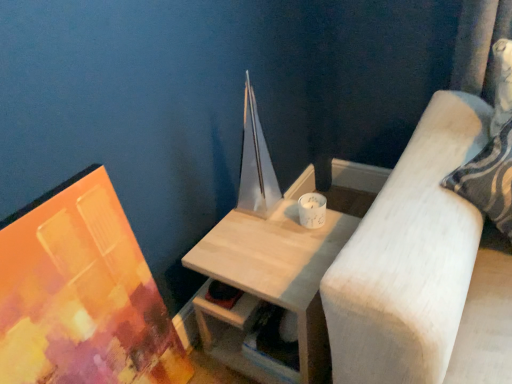
Question: Can you confirm if light wood table at center is bigger than white ceramic candle at upper right?

Choices:
 (A) no
 (B) yes

Answer: (B)

Question: Is light wood table at center outside of white ceramic candle at upper right?

Choices:
 (A) yes
 (B) no

Answer: (A)

Question: Is the position of light wood table at center more distant than that of white ceramic candle at upper right?

Choices:
 (A) yes
 (B) no

Answer: (B)

Question: From a real-world perspective, is light wood table at center located higher than white ceramic candle at upper right?

Choices:
 (A) yes
 (B) no

Answer: (B)

Question: Is the position of light wood table at center less distant than that of white ceramic candle at upper right?

Choices:
 (A) no
 (B) yes

Answer: (B)

Question: In terms of height, does light wood table at center look taller or shorter compared to white ceramic candle at upper right?

Choices:
 (A) tall
 (B) short

Answer: (A)

Question: Is light wood table at center to the left or to the right of white ceramic candle at upper right in the image?

Choices:
 (A) left
 (B) right

Answer: (A)

Question: Does point (282, 281) appear closer or farther from the camera than point (325, 200)?

Choices:
 (A) closer
 (B) farther

Answer: (A)

Question: From a real-world perspective, relative to white ceramic candle at upper right, is light wood table at center vertically above or below?

Choices:
 (A) below
 (B) above

Answer: (A)

Question: In terms of height, does matte acrylic painting at left look taller or shorter compared to white ceramic candle at upper right?

Choices:
 (A) tall
 (B) short

Answer: (A)

Question: Considering the positions of matte acrylic painting at left and white ceramic candle at upper right in the image, is matte acrylic painting at left wider or thinner than white ceramic candle at upper right?

Choices:
 (A) wide
 (B) thin

Answer: (A)

Question: Considering the positions of matte acrylic painting at left and white ceramic candle at upper right in the image, is matte acrylic painting at left bigger or smaller than white ceramic candle at upper right?

Choices:
 (A) big
 (B) small

Answer: (A)

Question: Would you say matte acrylic painting at left is inside or outside white ceramic candle at upper right?

Choices:
 (A) outside
 (B) inside

Answer: (A)

Question: Is white ceramic candle at upper right spatially inside matte acrylic painting at left, or outside of it?

Choices:
 (A) outside
 (B) inside

Answer: (A)

Question: Is white ceramic candle at upper right to the left or to the right of matte acrylic painting at left in the image?

Choices:
 (A) left
 (B) right

Answer: (B)